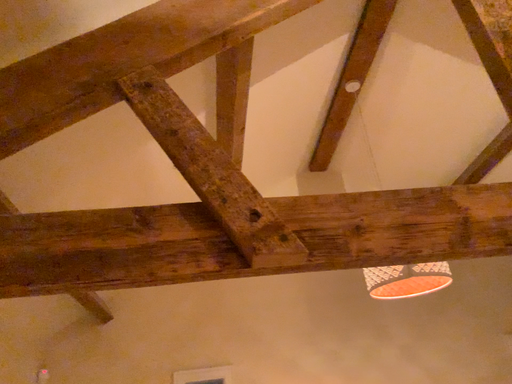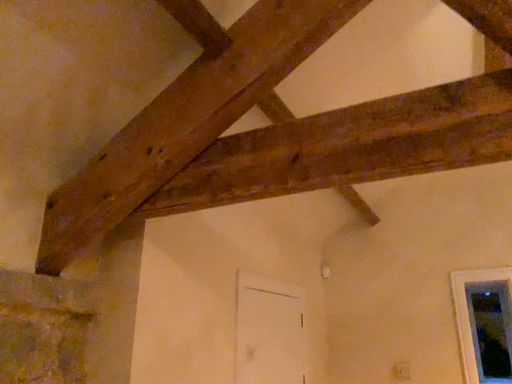
Question: How did the camera likely rotate when shooting the video?

Choices:
 (A) rotated downward
 (B) rotated upward

Answer: (A)